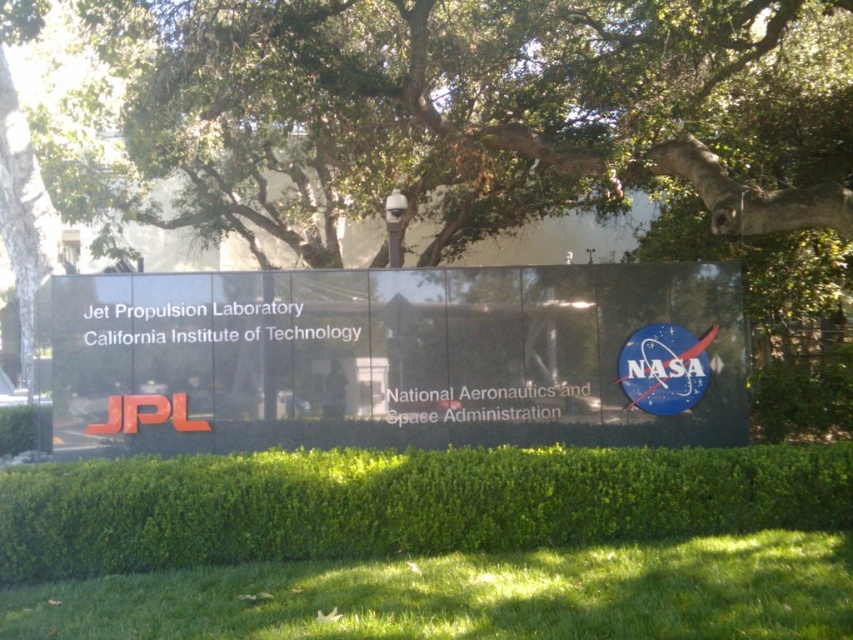
You are standing in front of the JPL signboard. There is a point marked at coordinates (399,502). What is located at this point on the signboard?

The point at coordinates (399,502) corresponds to the green leafy hedge at center.

You are standing in front of the JPL signboard and want to walk towards the green grass at lower center. Which direction should you walk relative to the green leafy hedge at center?

The green leafy hedge at center is to the right of the green grass at lower center, so to reach the green grass at lower center, you should walk to the left of the green leafy hedge at center.